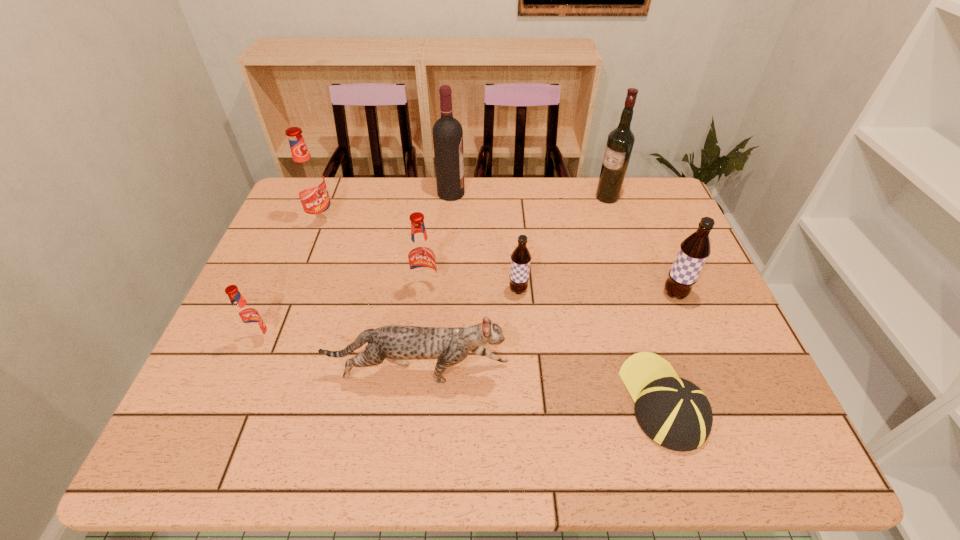
Find the location of a particular element. The image size is (960, 540). vacant space located 0.230m on the back of the third root beer from right to left is located at coordinates click(433, 225).

Identify the location of blank space located on the front of the right brown root beer. The width and height of the screenshot is (960, 540). (704, 366).

The height and width of the screenshot is (540, 960). Identify the location of free space located 0.050m on the front of the nearest root beer. (250, 368).

You are a GUI agent. You are given a task and a screenshot of the screen. Output one action in this format:
    pyautogui.click(x=<x>, y=<y>)
    Task: Click on the free space located on the right of the left brown root beer
    
    Given the screenshot: What is the action you would take?
    pyautogui.click(x=644, y=291)

Locate an element on the screen. free region located 0.140m on the face of the cat is located at coordinates (572, 373).

I want to click on free location located with the brim of the black baseball cap facing forward, so click(x=618, y=259).

The width and height of the screenshot is (960, 540). I want to click on free location located with the brim of the black baseball cap facing forward, so click(x=634, y=309).

Locate an element on the screen. Image resolution: width=960 pixels, height=540 pixels. free space located 0.260m with the brim of the black baseball cap facing forward is located at coordinates (623, 274).

You are a GUI agent. You are given a task and a screenshot of the screen. Output one action in this format:
    pyautogui.click(x=<x>, y=<y>)
    Task: Click on the root beer that is at the far edge
    The width and height of the screenshot is (960, 540).
    Given the screenshot: What is the action you would take?
    pyautogui.click(x=308, y=179)

The height and width of the screenshot is (540, 960). I want to click on object positioned at the near edge, so click(673, 412).